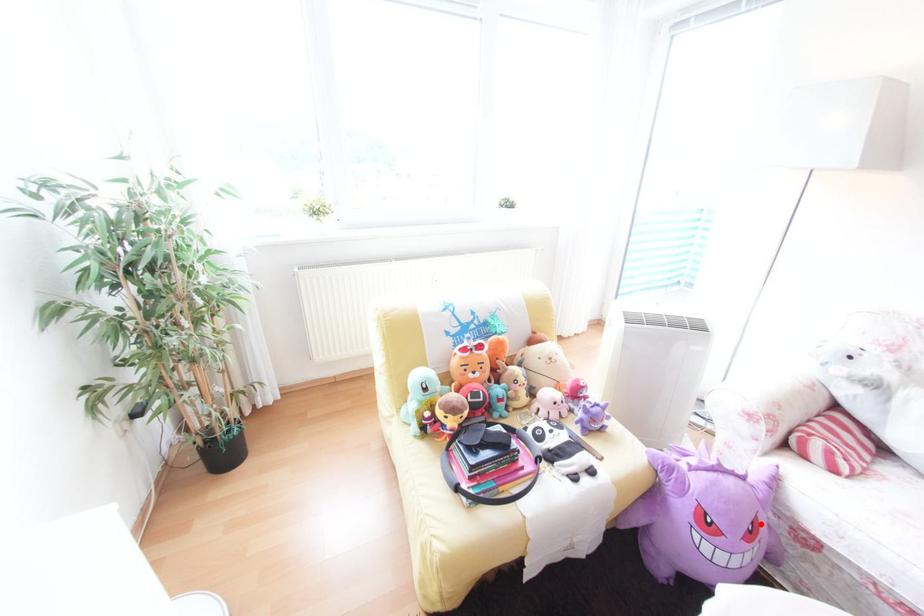
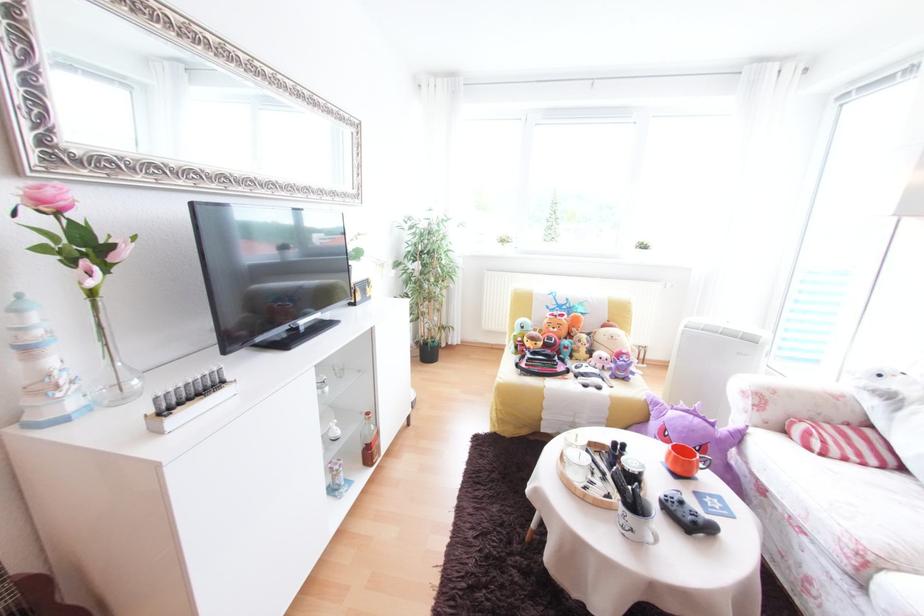
Locate, in the second image, the point that corresponds to the highlighted location in the first image.

(709, 447)